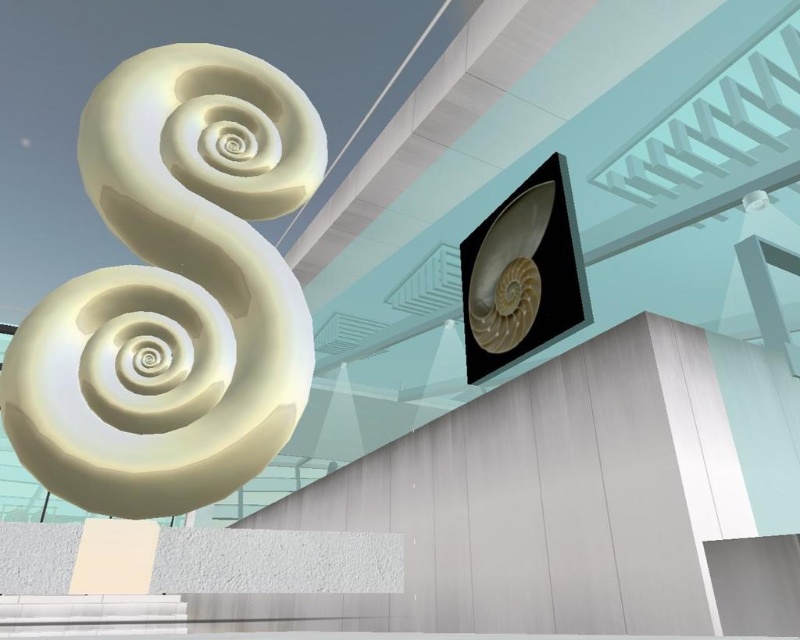
Which is more to the right, white glossy sculpture at upper left or matte white shell at upper right?

Positioned to the right is matte white shell at upper right.

Between white glossy sculpture at upper left and matte white shell at upper right, which one has less height?

matte white shell at upper right

Where is `white glossy sculpture at upper left`? The image size is (800, 640). white glossy sculpture at upper left is located at coordinates (173, 291).